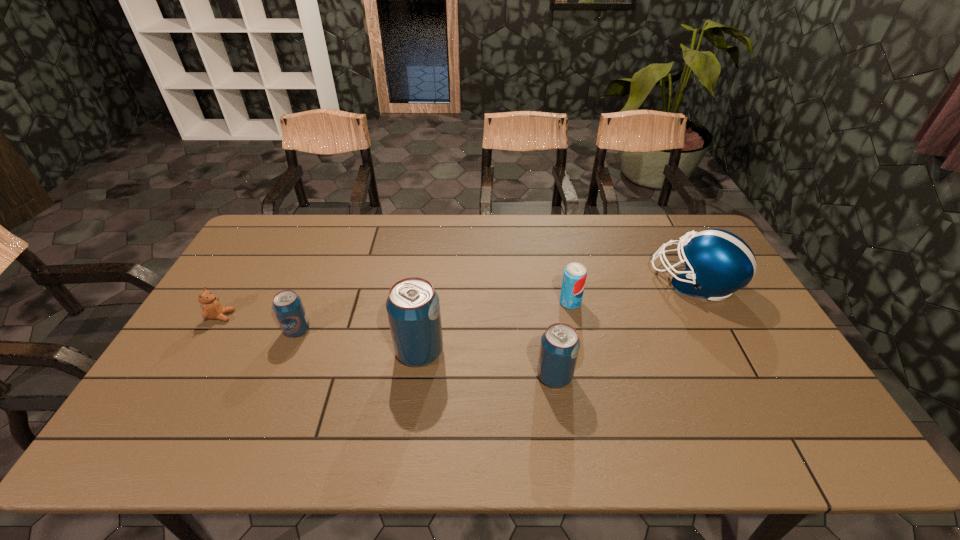
Where is `the leftmost soda can`? The width and height of the screenshot is (960, 540). the leftmost soda can is located at coordinates (287, 305).

Where is `the fourth object from right to left`? Image resolution: width=960 pixels, height=540 pixels. the fourth object from right to left is located at coordinates (413, 307).

Locate an element on the screen. The height and width of the screenshot is (540, 960). the tallest soda can is located at coordinates (413, 307).

The image size is (960, 540). In order to click on the fourth shortest object in this screenshot , I will do `click(560, 344)`.

Image resolution: width=960 pixels, height=540 pixels. I want to click on the third shortest soda can, so coord(560,344).

This screenshot has width=960, height=540. I want to click on teddy bear, so click(x=212, y=309).

This screenshot has width=960, height=540. Find the location of `the leftmost object`. the leftmost object is located at coordinates (212, 309).

Identify the location of football helmet. (718, 263).

The width and height of the screenshot is (960, 540). I want to click on the second object from right to left, so click(574, 278).

Where is `the rightmost soda can`? the rightmost soda can is located at coordinates (574, 278).